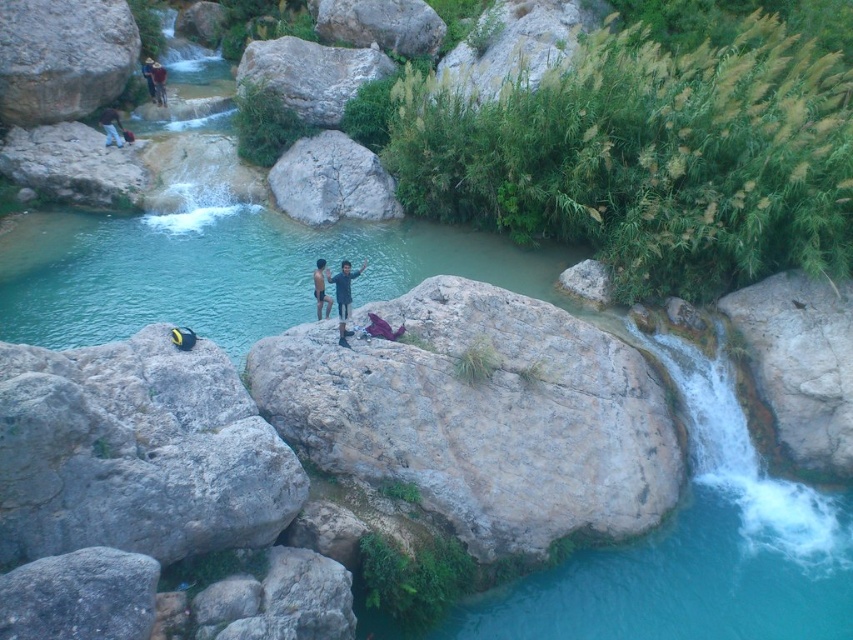
You are planning to climb the rocks in the scene. You see the gray rough rock at center and the gray rough boulder at left. Which one is located below the other?

The gray rough rock at center is positioned under the gray rough boulder at left.